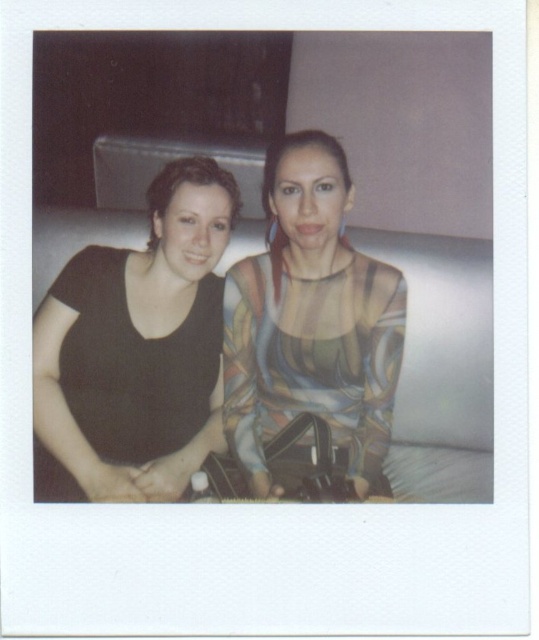
Question: From the image, what is the correct spatial relationship of black matte shirt at left in relation to translucent multicolored top at center?

Choices:
 (A) left
 (B) right

Answer: (A)

Question: Which object is the closest to the translucent multicolored top at center?

Choices:
 (A) black matte shirt at left
 (B) white fabric couch at center

Answer: (A)

Question: Does black matte shirt at left have a greater width compared to white fabric couch at center?

Choices:
 (A) no
 (B) yes

Answer: (B)

Question: Estimate the real-world distances between objects in this image. Which object is closer to the black matte shirt at left?

Choices:
 (A) white fabric couch at center
 (B) translucent multicolored top at center

Answer: (B)

Question: Observing the image, what is the correct spatial positioning of translucent multicolored top at center in reference to white fabric couch at center?

Choices:
 (A) right
 (B) left

Answer: (B)

Question: Based on their relative distances, which object is farther from the translucent multicolored top at center?

Choices:
 (A) white fabric couch at center
 (B) black matte shirt at left

Answer: (A)